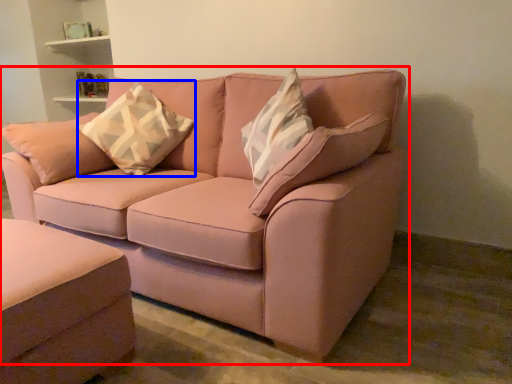
Question: Which point is further to the camera, studio couch (highlighted by a red box) or throw pillow (highlighted by a blue box)?

Choices:
 (A) studio couch
 (B) throw pillow

Answer: (B)